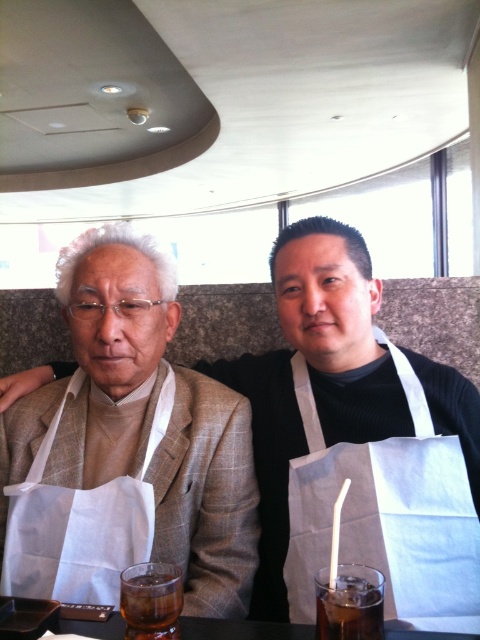
You are a customer at this restaurant and want to grab the brown translucent glass at lower center. Which direction should you move relative to the white textured apron at left?

The brown translucent glass at lower center is to the right of the white textured apron at left, so you should move to the right relative to the white textured apron at left to reach it.

You are a customer at this restaurant and want to place your phone on the table without it falling off. Considering the white textured apron at left and the dark brown glass at lower center, which item can you use to stabilize your phone?

The white textured apron at left has a larger size compared to the dark brown glass at lower center, so you can use the white textured apron at left to stabilize your phone as it provides a more stable and larger surface area.

You are a customer at a restaurant and see the white textured apron at left and the white fabric paper bag at center. Which item is closer to the left edge of the table?

The white textured apron at left is positioned on the left side of the white fabric paper bag at center, so it is closer to the left edge of the table.